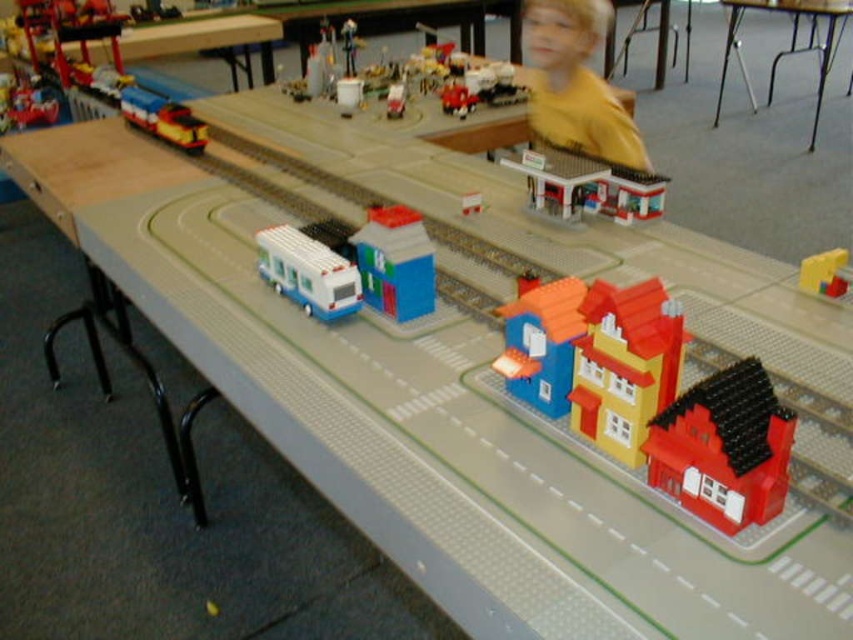
Can you confirm if white plastic bus at center is thinner than smooth plastic train at center?

Incorrect, white plastic bus at center's width is not less than smooth plastic train at center's.

Is white plastic bus at center positioned before smooth plastic train at center?

Yes.

Does point (314, 221) come in front of point (457, 90)?

That is True.

In order to click on white plastic bus at center in this screenshot , I will do `click(308, 272)`.

Does brick-patterned house at center have a lesser height compared to white plastic train at center?

No, brick-patterned house at center is not shorter than white plastic train at center.

Is brick-patterned house at center to the right of white plastic train at center from the viewer's perspective?

Yes, brick-patterned house at center is to the right of white plastic train at center.

Is point (369, 294) positioned in front of point (401, 86)?

Yes, point (369, 294) is closer to viewer.

Find the location of a particular element. The width and height of the screenshot is (853, 640). brick-patterned house at center is located at coordinates (395, 262).

Does point (746, 492) lie behind point (566, 288)?

No, it is not.

Can you confirm if brick red house at lower right is taller than blue plastic house at center?

Incorrect, brick red house at lower right's height is not larger of blue plastic house at center's.

Where is `brick red house at lower right`? The height and width of the screenshot is (640, 853). brick red house at lower right is located at coordinates (724, 449).